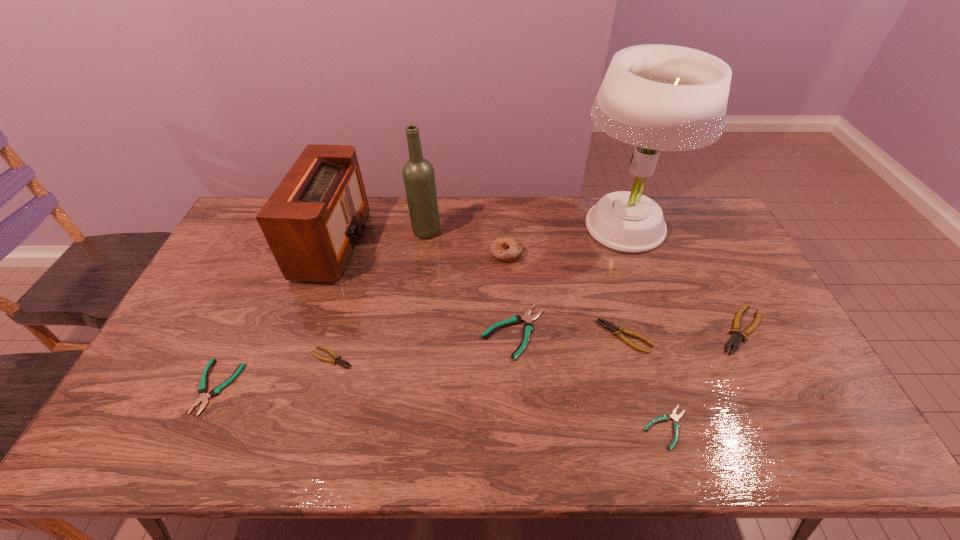
Locate an element on the screen. This screenshot has height=540, width=960. free location located 0.190m on the right of the doughnut is located at coordinates (579, 254).

Image resolution: width=960 pixels, height=540 pixels. What are the coordinates of `vacant position located 0.170m on the left of the sixth shortest object` in the screenshot? It's located at (656, 330).

You are a GUI agent. You are given a task and a screenshot of the screen. Output one action in this format:
    pyautogui.click(x=<x>, y=<y>)
    Task: Click on the vacant space located on the right of the second teal pliers from right to left
    The image size is (960, 540).
    Given the screenshot: What is the action you would take?
    pyautogui.click(x=650, y=332)

At what (x,y) coordinates should I click in order to perform the action: click on vacant region located on the left of the second yellow pliers from right to left. Please return your answer as a coordinate pair (x, y). The height and width of the screenshot is (540, 960). Looking at the image, I should click on (571, 336).

The image size is (960, 540). In order to click on free space located on the right of the second biggest teal pliers in this screenshot , I will do `click(356, 387)`.

Image resolution: width=960 pixels, height=540 pixels. I want to click on vacant region located on the left of the second pliers from left to right, so tap(293, 357).

At what (x,y) coordinates should I click in order to perform the action: click on free space located 0.180m on the back of the rightmost teal pliers. Please return your answer as a coordinate pair (x, y). Looking at the image, I should click on (641, 347).

This screenshot has width=960, height=540. I want to click on lamp at the far edge, so click(x=656, y=97).

The width and height of the screenshot is (960, 540). What are the coordinates of `wine bottle that is positioned at the far edge` in the screenshot? It's located at (418, 173).

Locate an element on the screen. The width and height of the screenshot is (960, 540). radio receiver that is at the far edge is located at coordinates (312, 222).